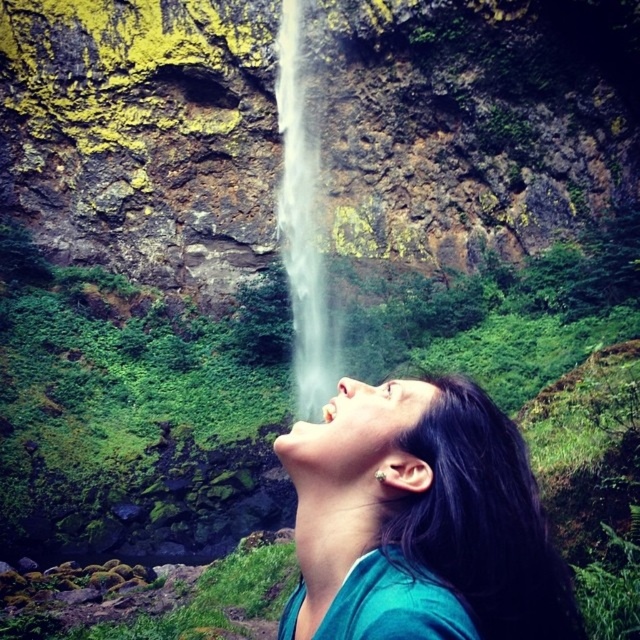
In the scene shown: Who is more forward, [419,532] or [298,250]?

Point [419,532] is in front.

Looking at this image, does teal fabric shirt at center come behind white misty waterfall at center?

No, it is in front of white misty waterfall at center.

The width and height of the screenshot is (640, 640). Describe the element at coordinates (422, 512) in the screenshot. I see `teal fabric shirt at center` at that location.

The image size is (640, 640). Identify the location of teal fabric shirt at center. (422, 512).